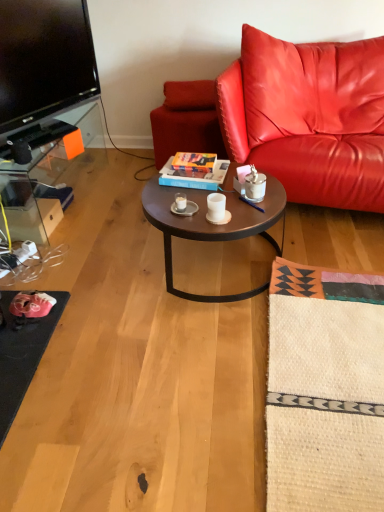
At what (x,y) coordinates should I click in order to perform the action: click on vacant space that's between white matte cup at center, which ranks as the 2th coffee cup in left-to-right order, and metallic pen at center. Please return your answer as a coordinate pair (x, y). The width and height of the screenshot is (384, 512). Looking at the image, I should click on (248, 207).